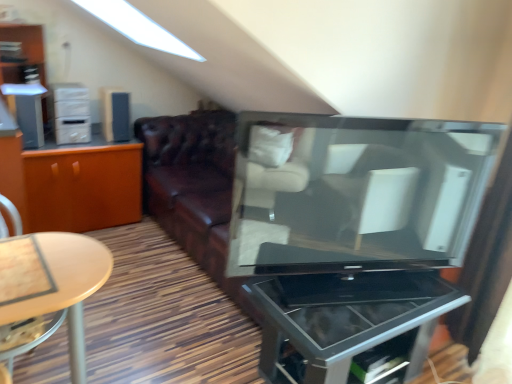
Find the location of a particular element. This screenshot has height=384, width=512. blank space situated above satin silver speaker at left, which is counted as the 1th appliance, starting from the left (from a real-world perspective) is located at coordinates (22, 89).